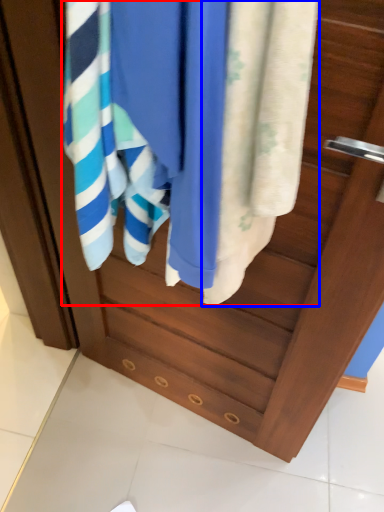
Question: Which object appears closest to the camera in this image, bath towel (highlighted by a red box) or towel (highlighted by a blue box)?

Choices:
 (A) bath towel
 (B) towel

Answer: (B)